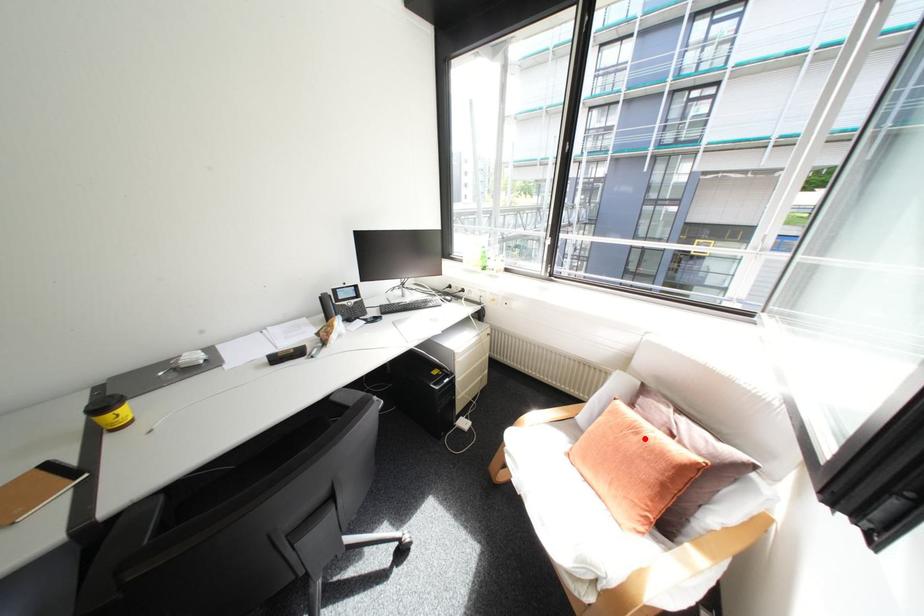
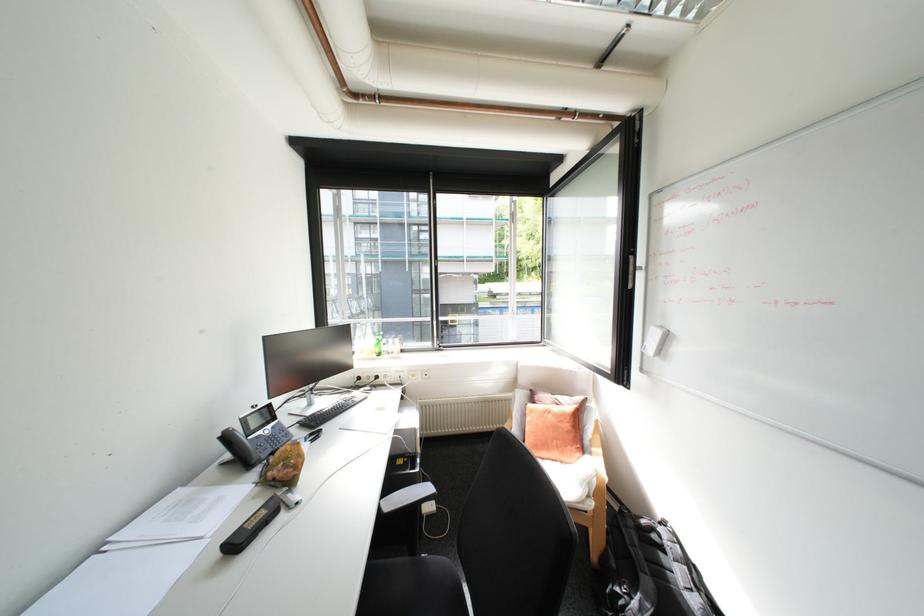
Find the pixel in the second image that matches the highlighted location in the first image.

(561, 416)